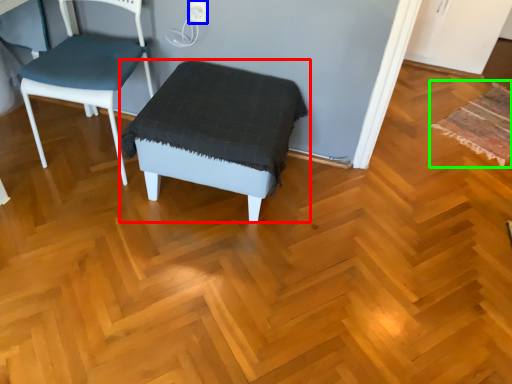
Question: Estimate the real-world distances between objects in this image. Which object is closer to stool (highlighted by a red box), electric outlet (highlighted by a blue box) or mat (highlighted by a green box)?

Choices:
 (A) electric outlet
 (B) mat

Answer: (A)